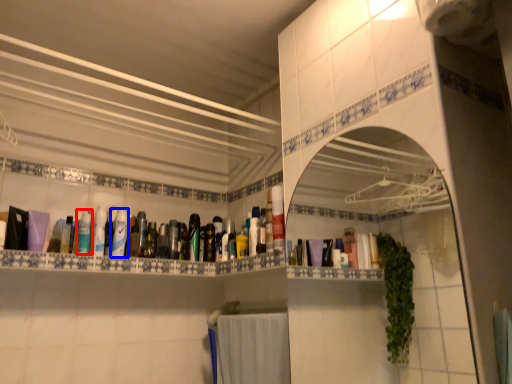
Question: Among these objects, which one is nearest to the camera, mouthwash (highlighted by a red box) or mouthwash (highlighted by a blue box)?

Choices:
 (A) mouthwash
 (B) mouthwash

Answer: (A)